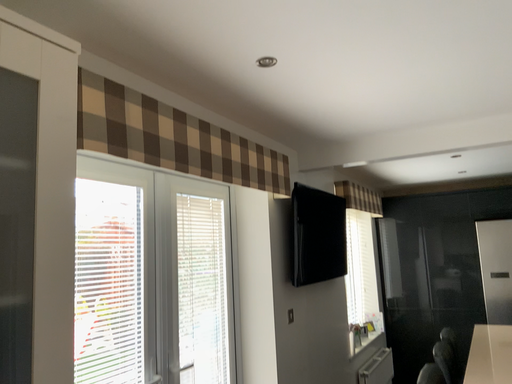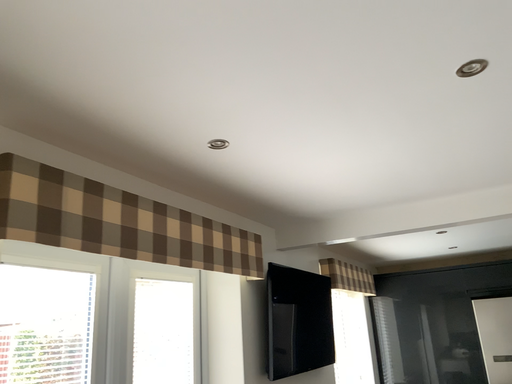
Question: How did the camera likely rotate when shooting the video?

Choices:
 (A) rotated upward
 (B) rotated downward

Answer: (A)